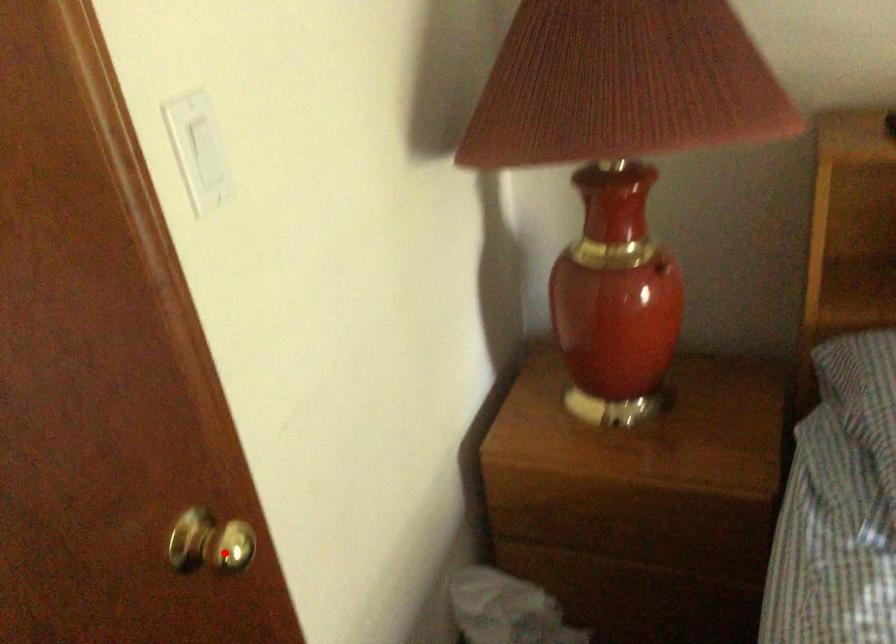
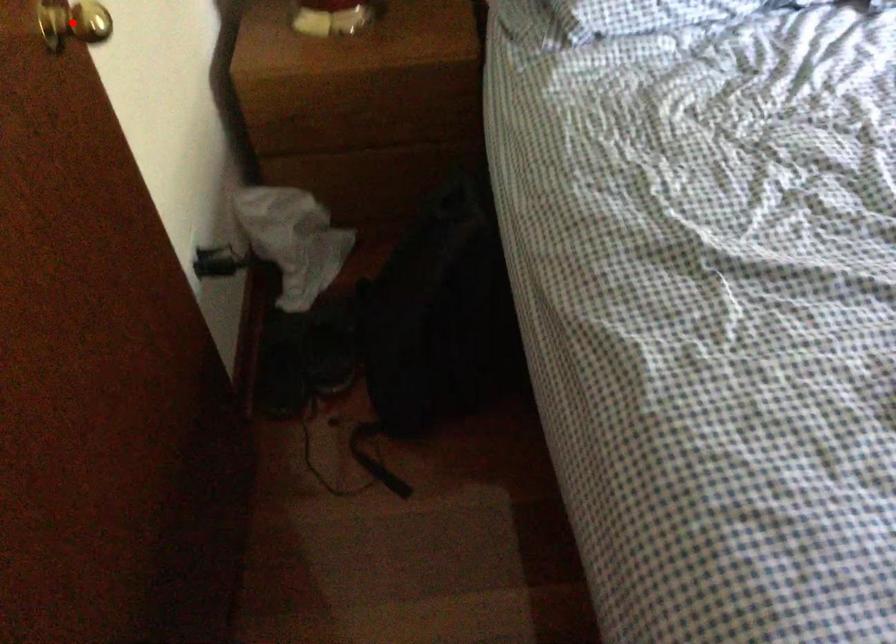
I am providing you with two images of the same scene from different viewpoints. A red point is marked on the first image and another point is marked on the second image. Do the highlighted points in image1 and image2 indicate the same real-world spot?

Yes